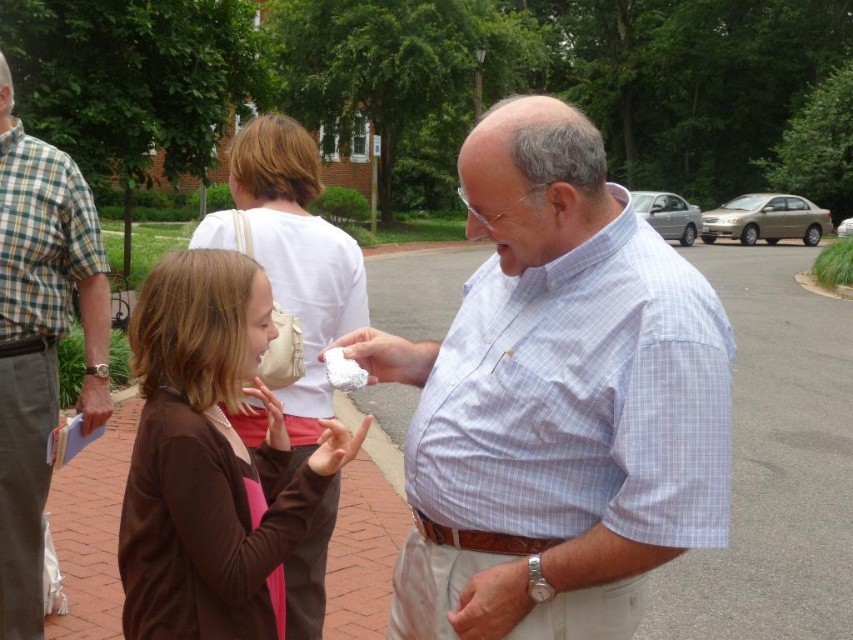
You are a photographer standing at the center of the parking lot. You want to take a photo of both the light blue checkered shirt at center and the checkered fabric shirt at left. The minimum distance between the two shirts needed for your camera to focus on both is 4 feet. Can you capture both shirts in focus?

The light blue checkered shirt at center and checkered fabric shirt at left are 5.06 feet apart, which exceeds the minimum required distance of 4 feet. Therefore, you can capture both shirts in focus.